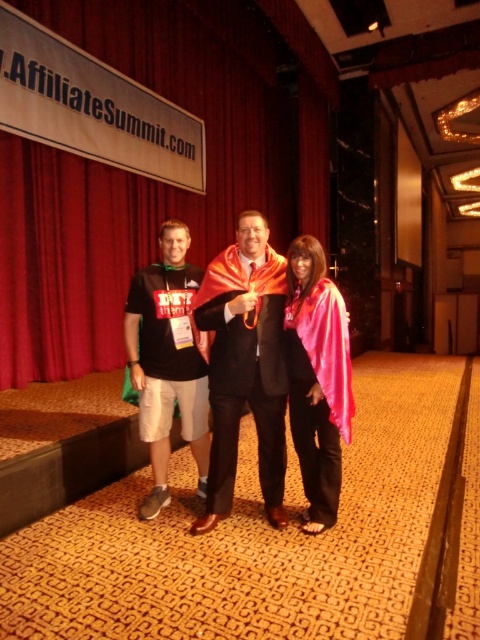
You are a photographer at AffiliateSummit.com. You need to ensure that both the shiny orange cape at center and the pink satin cape at center are fully visible in your photo. Which cape should you focus on adjusting first to avoid being cut off?

The shiny orange cape at center might be wider than the pink satin cape at center, so you should focus on adjusting the shiny orange cape at center first to ensure it fits within the frame.